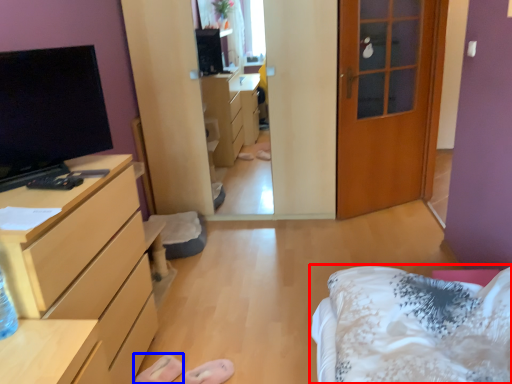
Question: Which of the following is the farthest to the observer, bed (highlighted by a red box) or shoe (highlighted by a blue box)?

Choices:
 (A) bed
 (B) shoe

Answer: (B)